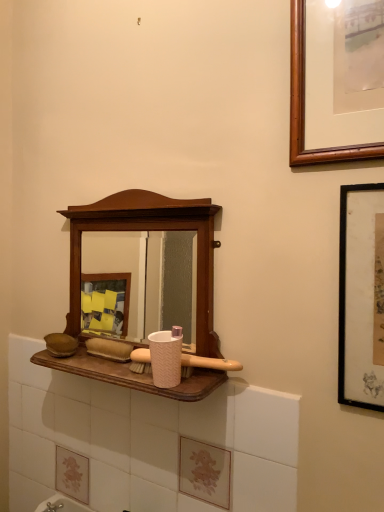
Question: From the image's perspective, is pink textured cup at center located above or below wooden medicine cabinet at center?

Choices:
 (A) below
 (B) above

Answer: (A)

Question: From their relative heights in the image, would you say pink textured cup at center is taller or shorter than wooden medicine cabinet at center?

Choices:
 (A) tall
 (B) short

Answer: (B)

Question: Based on their relative distances, which object is nearer to the wooden medicine cabinet at center?

Choices:
 (A) pink textured cup at center
 (B) black matte picture frame at right
 (C) pink textured brush at center

Answer: (A)

Question: Which object is positioned closest to the wooden medicine cabinet at center?

Choices:
 (A) pink textured cup at center
 (B) pink textured brush at center
 (C) black matte picture frame at right

Answer: (A)